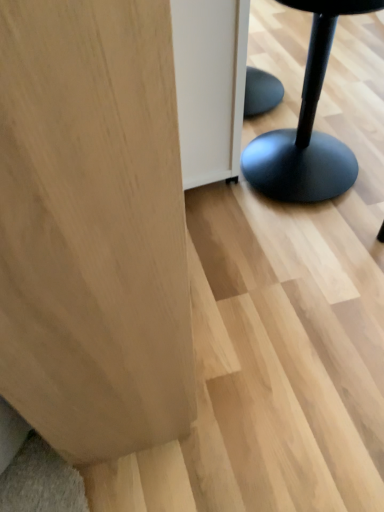
Question: Based on their sizes in the image, would you say natural wood plywood at lower left is bigger or smaller than black matte stool at right?

Choices:
 (A) big
 (B) small

Answer: (A)

Question: From the image's perspective, is natural wood plywood at lower left above or below black matte stool at right?

Choices:
 (A) above
 (B) below

Answer: (B)

Question: Is natural wood plywood at lower left to the left or to the right of black matte stool at right in the image?

Choices:
 (A) right
 (B) left

Answer: (B)

Question: From the image's perspective, is black matte stool at right located above or below natural wood plywood at lower left?

Choices:
 (A) above
 (B) below

Answer: (A)

Question: In terms of height, does black matte stool at right look taller or shorter compared to natural wood plywood at lower left?

Choices:
 (A) tall
 (B) short

Answer: (B)

Question: Is black matte stool at right situated inside natural wood plywood at lower left or outside?

Choices:
 (A) outside
 (B) inside

Answer: (A)

Question: In terms of width, does black matte stool at right look wider or thinner when compared to natural wood plywood at lower left?

Choices:
 (A) thin
 (B) wide

Answer: (A)